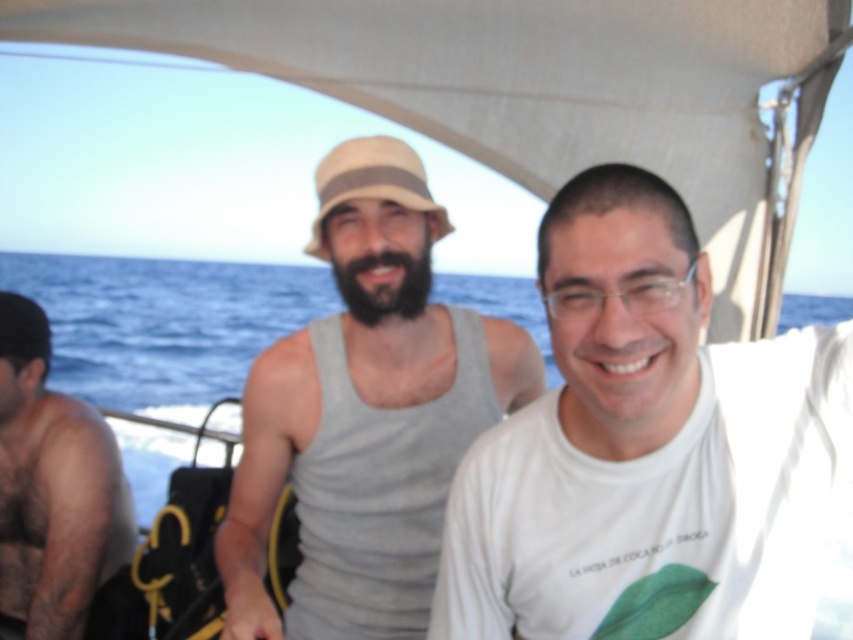
You are a photographer standing on the deck of a boat. You want to take a photo of the blue water at center and the skinny black tank top at left. If your camera has a maximum focus range of 15 feet, will you be able to capture both subjects in focus at the same time?

The blue water at center and skinny black tank top at left are 14.98 feet apart. Since the distance between them is within the camera maximum focus range of 15 feet, you can capture both subjects in focus at the same time.

You are a photographer trying to capture both the blue water at center and the skinny black tank top at left in a single shot. Given that your camera can only focus on objects within a 100cm width, can you fit both in the frame?

The blue water at center is wider than the skinny black tank top at left, but without knowing their exact widths, it is impossible to determine if they can both fit within the 100cm width constraint.